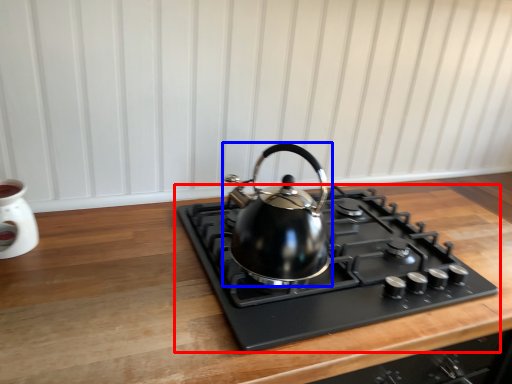
Question: Which object appears closest to the camera in this image, gas stove (highlighted by a red box) or kettle (highlighted by a blue box)?

Choices:
 (A) gas stove
 (B) kettle

Answer: (A)